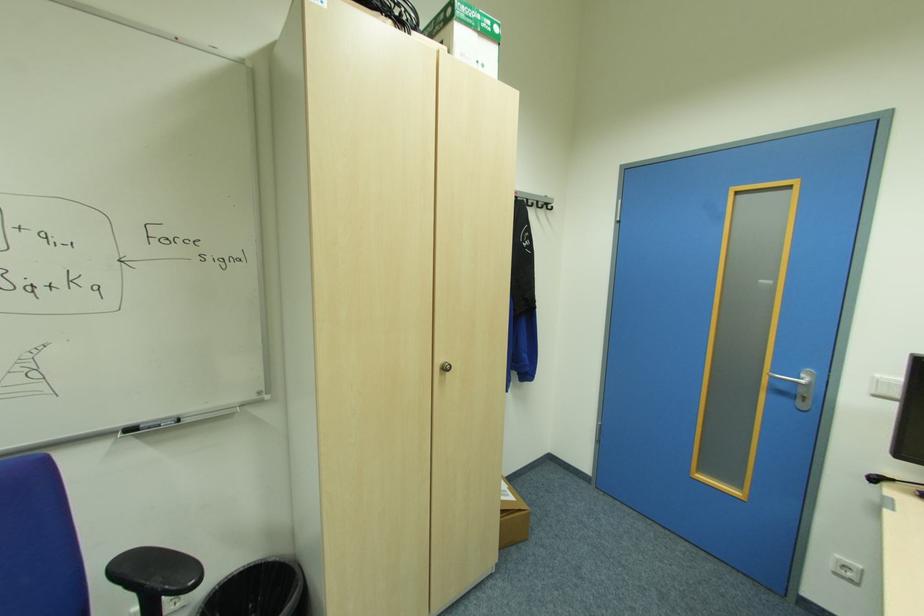
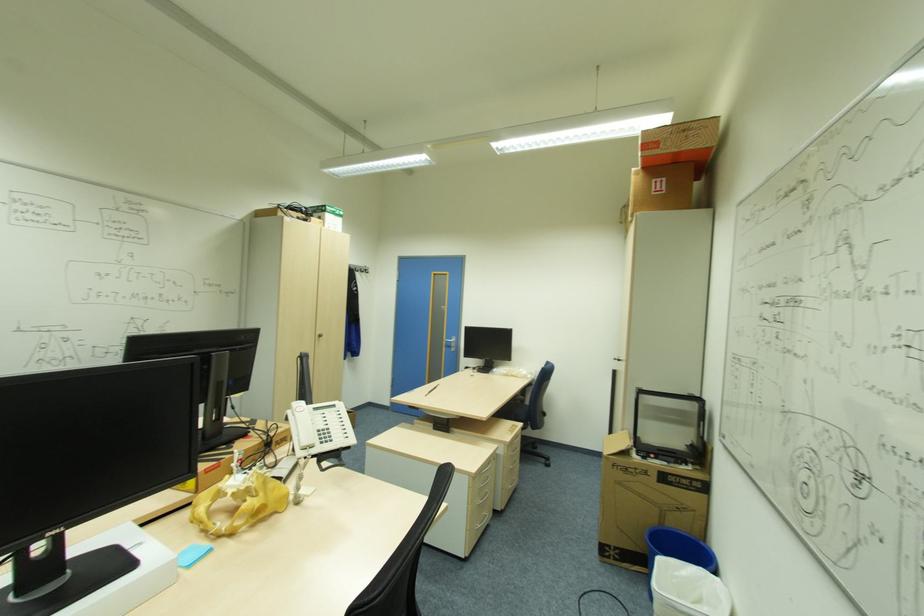
Question: The images are taken continuously from a first-person perspective. In which direction are you moving?

Choices:
 (A) Left
 (B) Right
 (C) Forward
 (D) Backward

Answer: (D)